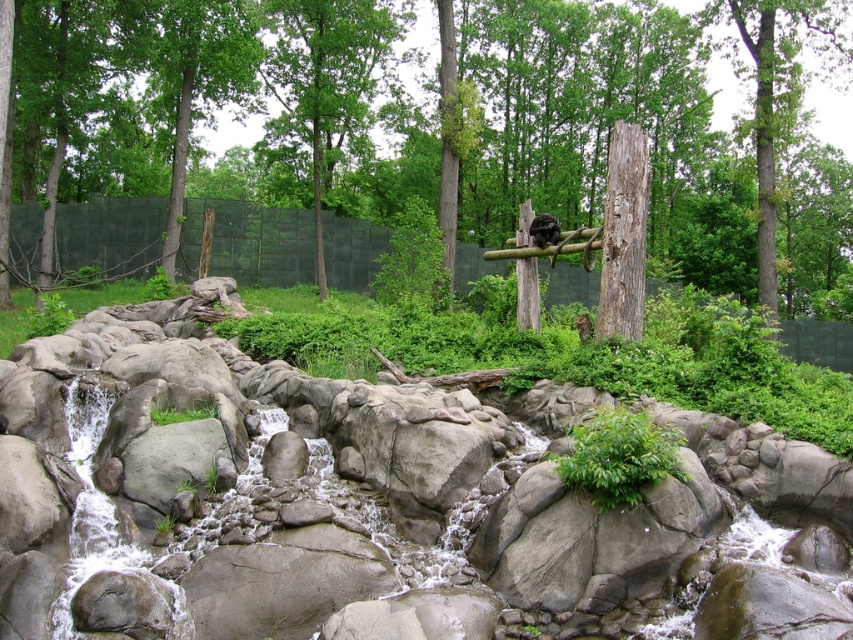
Does smooth gray rock at center appear over brown rough tree trunk at upper center?

Correct, smooth gray rock at center is located above brown rough tree trunk at upper center.

Is smooth gray rock at center to the left of brown rough tree trunk at upper center from the viewer's perspective?

→ Yes, smooth gray rock at center is to the left of brown rough tree trunk at upper center.

Between point (668, 232) and point (770, 182), which one is positioned behind?

Point (668, 232)

Find the location of `smooth gray rock at center`. smooth gray rock at center is located at coordinates pos(219,102).

Is brown rough tree trunk at upper center bigger than black fur monkey at center?

Indeed, brown rough tree trunk at upper center has a larger size compared to black fur monkey at center.

Does brown rough tree trunk at upper center appear over black fur monkey at center?

Yes.

The height and width of the screenshot is (640, 853). Identify the location of brown rough tree trunk at upper center. (780, 90).

Is smooth gray rock at center further to camera compared to green leafy tree at center?

That is False.

Between smooth gray rock at center and green leafy tree at center, which one appears on the left side from the viewer's perspective?

green leafy tree at center is more to the left.

Which is in front, point (300, 184) or point (318, 212)?

Point (318, 212) is more forward.

Locate an element on the screen. The height and width of the screenshot is (640, 853). smooth gray rock at center is located at coordinates tap(219, 102).